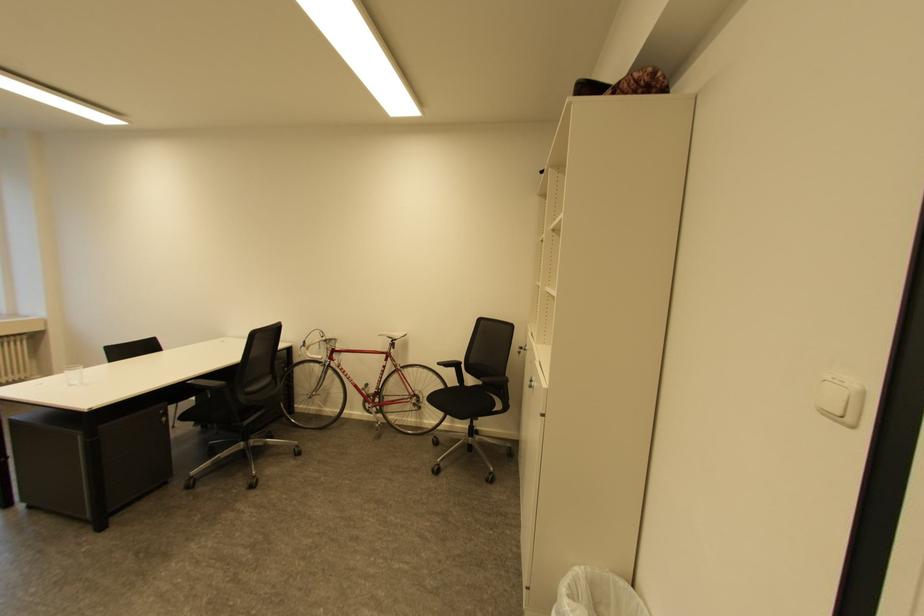
Where is `silver cabinet handle`? silver cabinet handle is located at coordinates (529, 383).